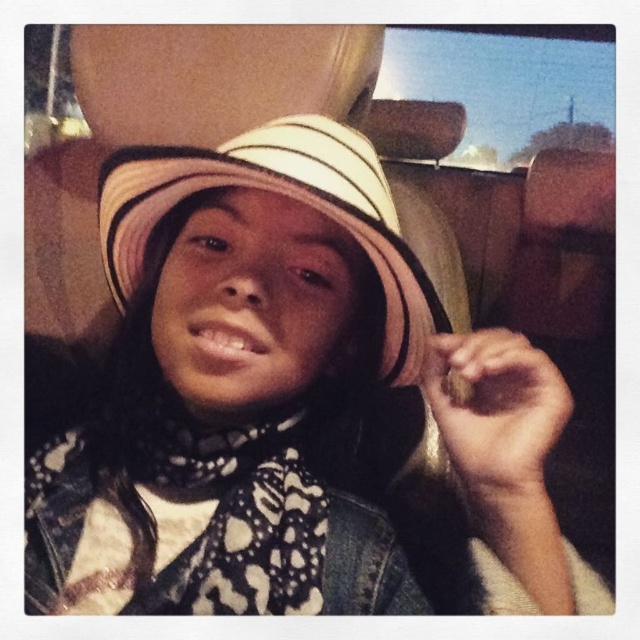
Question: Does white striped hat at center have a smaller size compared to white striped fabric hat at center?

Choices:
 (A) no
 (B) yes

Answer: (A)

Question: Which of the following is the closest to the observer?

Choices:
 (A) (124, 182)
 (B) (497, 442)
 (C) (296, 417)

Answer: (B)

Question: Does white striped hat at center lie in front of black printed scarf at center?

Choices:
 (A) yes
 (B) no

Answer: (A)

Question: Which object is the closest to the black printed scarf at center?

Choices:
 (A) white striped hat at center
 (B) white striped fabric hat at center

Answer: (A)

Question: Which of the following is the farthest from the observer?

Choices:
 (A) black printed scarf at center
 (B) white striped hat at center

Answer: (A)

Question: Can you confirm if white striped hat at center is thinner than black printed scarf at center?

Choices:
 (A) yes
 (B) no

Answer: (B)